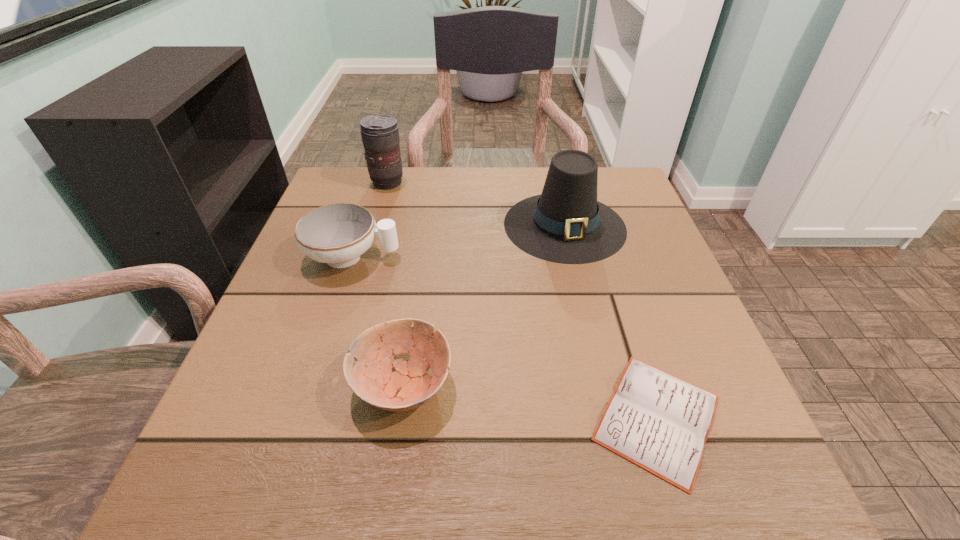
Find the location of a particular element. This screenshot has width=960, height=540. free spot that satisfies the following two spatial constraints: 1. on the side with the handle of the chinaware; 2. on the right side of the second shortest object is located at coordinates (311, 385).

I want to click on free point that satisfies the following two spatial constraints: 1. on the back side of the second shortest object; 2. on the side with the handle of the chinaware, so [422, 257].